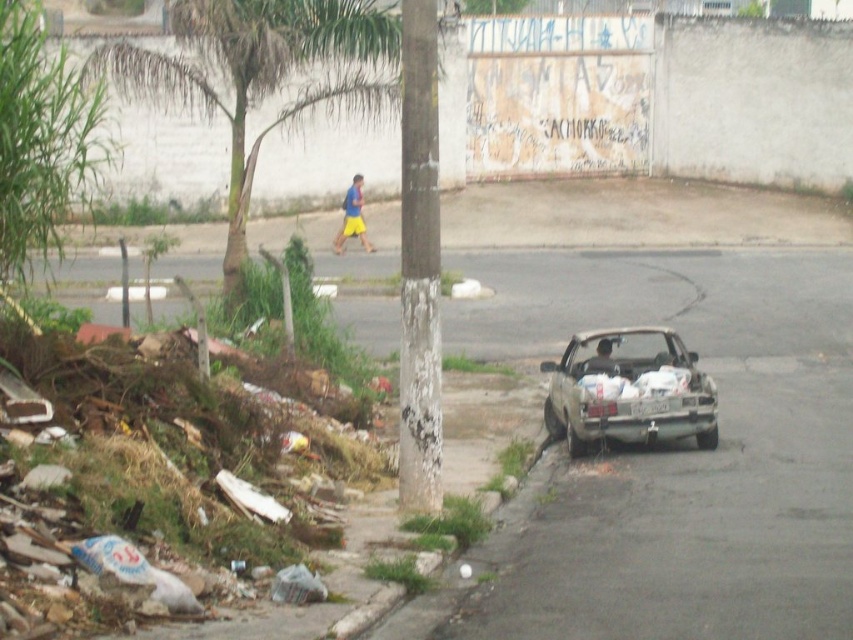
Question: Does green leafy palm tree at upper left have a lesser width compared to silver metallic car at lower right?

Choices:
 (A) yes
 (B) no

Answer: (B)

Question: Which object is positioned farthest from the green leafy tree at left?

Choices:
 (A) green leafy palm tree at upper left
 (B) silver metallic car at lower right
 (C) dark brown leather jacket at center
 (D) blue/yellow shorts at center

Answer: (D)

Question: Does silver metallic car at lower right appear on the left side of dark brown leather jacket at center?

Choices:
 (A) no
 (B) yes

Answer: (A)

Question: Estimate the real-world distances between objects in this image. Which object is farther from the silver metallic car at lower right?

Choices:
 (A) blue/yellow shorts at center
 (B) green leafy tree at left
 (C) dark brown leather jacket at center

Answer: (A)

Question: Which point appears farthest from the camera in this image?

Choices:
 (A) (189, 32)
 (B) (358, 218)

Answer: (B)

Question: Is green leafy tree at left to the right of blue/yellow shorts at center from the viewer's perspective?

Choices:
 (A) no
 (B) yes

Answer: (A)